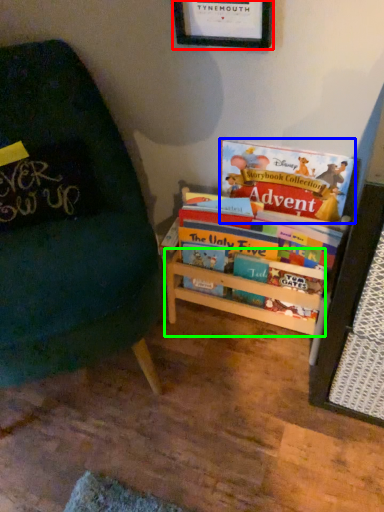
Question: Based on their relative distances, which object is farther from picture frame (highlighted by a red box)? Choose from book (highlighted by a blue box) and shelf (highlighted by a green box).

Choices:
 (A) book
 (B) shelf

Answer: (B)